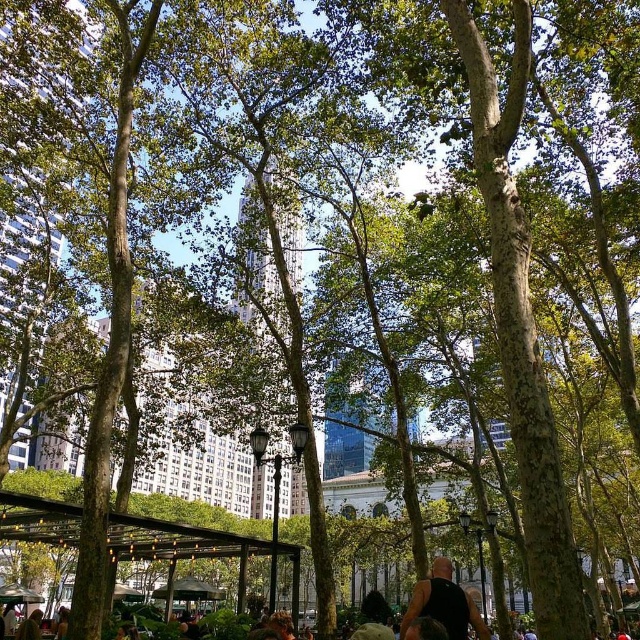
You are a visitor in the park and want to find the metallic silver canopy at lower left. From the brown wooden canopy at center, which direction should you look to locate it?

The metallic silver canopy at lower left is to the left of the brown wooden canopy at center, so you should look to the left to locate it.

You are a fashion designer observing the vibrant urban park scene. You notice a black sleeveless shirt at center and a metallic silver canopy at lower left. Which item has a narrower width?

The black sleeveless shirt at center is thinner than the metallic silver canopy at lower left, so the black sleeveless shirt at center has a narrower width.